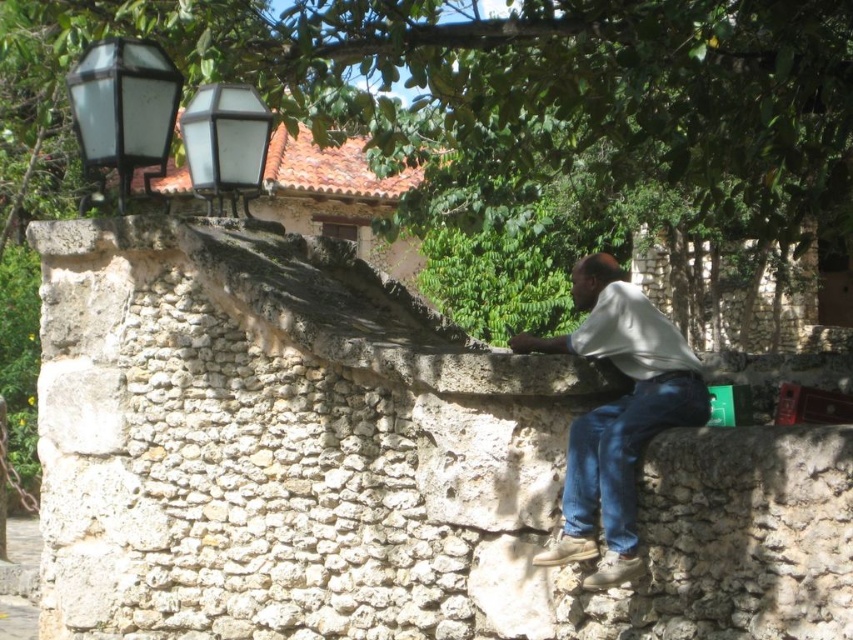
Is white rough stone at center closer to camera compared to clear glass lantern at upper left?

Yes, it is.

Is the position of white rough stone at center more distant than that of clear glass lantern at upper left?

No, white rough stone at center is closer to the viewer.

Which is behind, point (838, 580) or point (264, 150)?

The point (264, 150) is behind.

The image size is (853, 640). I want to click on white rough stone at center, so 372,464.

This screenshot has height=640, width=853. What do you see at coordinates (616, 413) in the screenshot?
I see `white cotton shirt at center` at bounding box center [616, 413].

Consider the image. Which is below, white cotton shirt at center or blue denim jeans at lower right?

blue denim jeans at lower right is below.

Describe the element at coordinates (616, 413) in the screenshot. The height and width of the screenshot is (640, 853). I see `white cotton shirt at center` at that location.

Identify the location of white cotton shirt at center. Image resolution: width=853 pixels, height=640 pixels. (616, 413).

Measure the distance between white rough stone at center and camera.

white rough stone at center is 24.17 meters from camera.

Can you confirm if white rough stone at center is taller than matte glass lamp post at upper left?

Yes, white rough stone at center is taller than matte glass lamp post at upper left.

Does point (67, 348) come behind point (134, 61)?

That is False.

Locate an element on the screen. white rough stone at center is located at coordinates (372, 464).